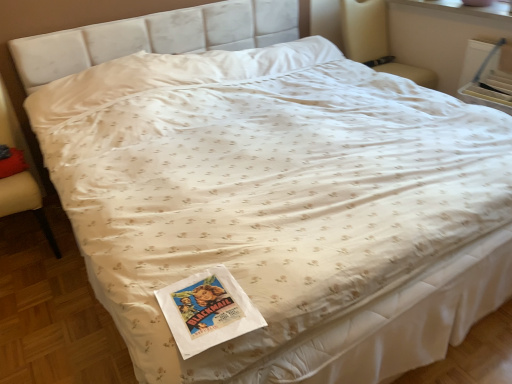
Question: Can we say velvet beige armchair at left, marked as the second armchair in a back-to-front arrangement, lies outside red cotton pillow at lower left?

Choices:
 (A) no
 (B) yes

Answer: (B)

Question: Are velvet beige armchair at left, the first armchair when ordered from bottom to top, and red cotton pillow at lower left located far from each other?

Choices:
 (A) no
 (B) yes

Answer: (A)

Question: Is velvet beige armchair at left, positioned as the second armchair in right-to-left order, oriented away from red cotton pillow at lower left?

Choices:
 (A) no
 (B) yes

Answer: (B)

Question: Considering the relative positions of velvet beige armchair at left, placed as the 1th armchair when sorted from front to back, and red cotton pillow at lower left in the image provided, is velvet beige armchair at left, placed as the 1th armchair when sorted from front to back, to the left of red cotton pillow at lower left from the viewer's perspective?

Choices:
 (A) no
 (B) yes

Answer: (B)

Question: Is the surface of velvet beige armchair at left, the first armchair when ordered from bottom to top, in direct contact with red cotton pillow at lower left?

Choices:
 (A) no
 (B) yes

Answer: (A)

Question: From a real-world perspective, relative to beige fabric armchair at upper right, the first armchair positioned from the right, is red cotton pillow at lower left vertically above or below?

Choices:
 (A) below
 (B) above

Answer: (A)

Question: Considering their positions, is red cotton pillow at lower left located in front of or behind beige fabric armchair at upper right, the 2th armchair in the bottom-to-top sequence?

Choices:
 (A) front
 (B) behind

Answer: (A)

Question: Does point (17, 162) appear closer or farther from the camera than point (368, 49)?

Choices:
 (A) farther
 (B) closer

Answer: (B)

Question: Would you say red cotton pillow at lower left is to the left or to the right of beige fabric armchair at upper right, marked as the 1th armchair in a back-to-front arrangement, in the picture?

Choices:
 (A) right
 (B) left

Answer: (B)

Question: Considering the positions of red cotton pillow at lower left and velvet beige armchair at left, positioned as the second armchair in right-to-left order, in the image, is red cotton pillow at lower left taller or shorter than velvet beige armchair at left, positioned as the second armchair in right-to-left order,?

Choices:
 (A) short
 (B) tall

Answer: (A)

Question: From a real-world perspective, is red cotton pillow at lower left positioned above or below velvet beige armchair at left, the first armchair from the left?

Choices:
 (A) above
 (B) below

Answer: (A)

Question: Is red cotton pillow at lower left bigger or smaller than velvet beige armchair at left, arranged as the 2th armchair when viewed from the top?

Choices:
 (A) small
 (B) big

Answer: (A)

Question: Is point (16, 152) closer or farther from the camera than point (13, 114)?

Choices:
 (A) farther
 (B) closer

Answer: (B)

Question: In terms of size, does velvet beige armchair at left, placed as the 1th armchair when sorted from front to back, appear bigger or smaller than beige fabric armchair at upper right, marked as the 1th armchair in a back-to-front arrangement?

Choices:
 (A) big
 (B) small

Answer: (A)

Question: Considering their positions, is velvet beige armchair at left, arranged as the 2th armchair when viewed from the top, located in front of or behind beige fabric armchair at upper right, the first armchair positioned from the right?

Choices:
 (A) front
 (B) behind

Answer: (A)